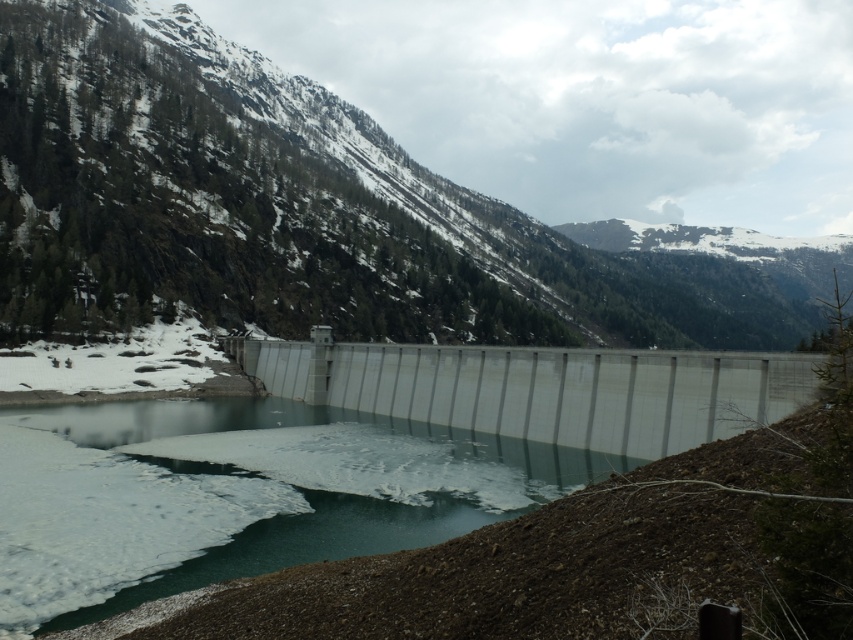
Question: Is translucent ice at center to the right of gray concrete dam at center from the viewer's perspective?

Choices:
 (A) yes
 (B) no

Answer: (B)

Question: Which object appears farthest from the camera in this image?

Choices:
 (A) snowy forested mountain at upper center
 (B) translucent ice at center

Answer: (A)

Question: Among these objects, which one is nearest to the camera?

Choices:
 (A) snowy forested mountain at upper center
 (B) gray concrete dam at center
 (C) translucent ice at center

Answer: (C)

Question: Can you confirm if snowy forested mountain at upper center is positioned to the right of translucent ice at center?

Choices:
 (A) yes
 (B) no

Answer: (A)

Question: Can you confirm if snowy forested mountain at upper center is wider than gray concrete dam at center?

Choices:
 (A) yes
 (B) no

Answer: (A)

Question: Estimate the real-world distances between objects in this image. Which object is farther from the snowy forested mountain at upper center?

Choices:
 (A) gray concrete dam at center
 (B) translucent ice at center

Answer: (A)